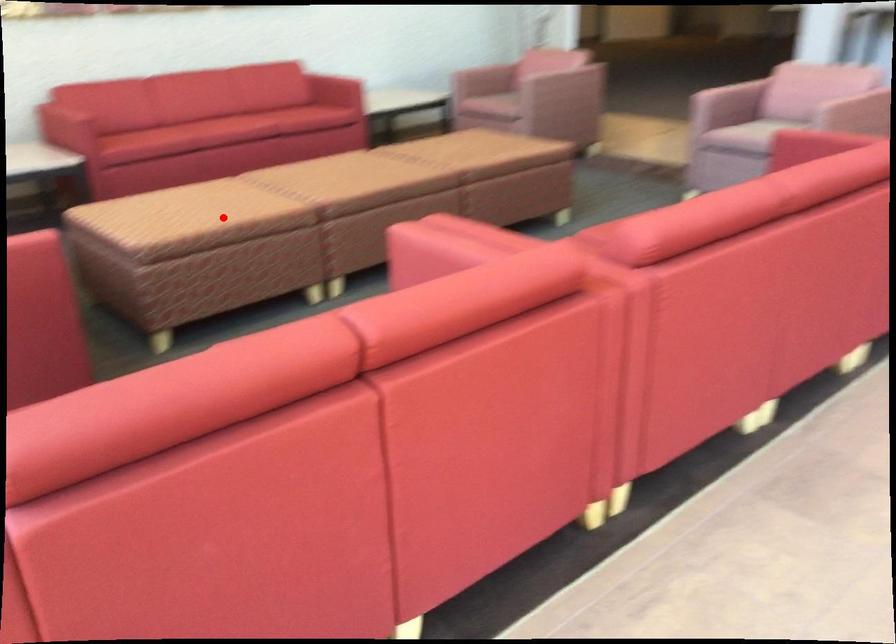
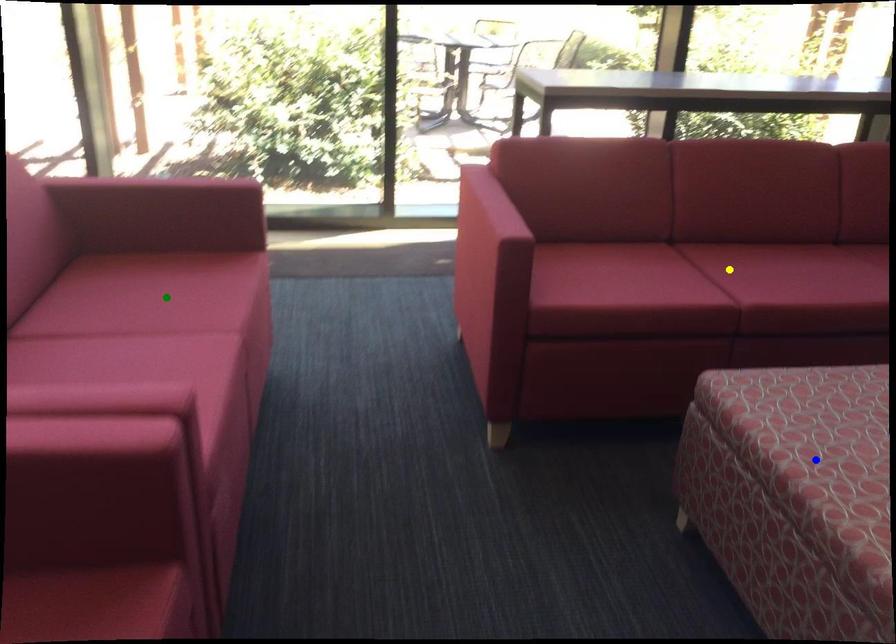
Question: I am providing you with two images of the same scene from different viewpoints. A red point is marked on the first image. You are given multiple points on the second image. Which point in image 2 represents the same 3d spot as the red point in image 1?

Choices:
 (A) blue point
 (B) yellow point
 (C) green point

Answer: (A)